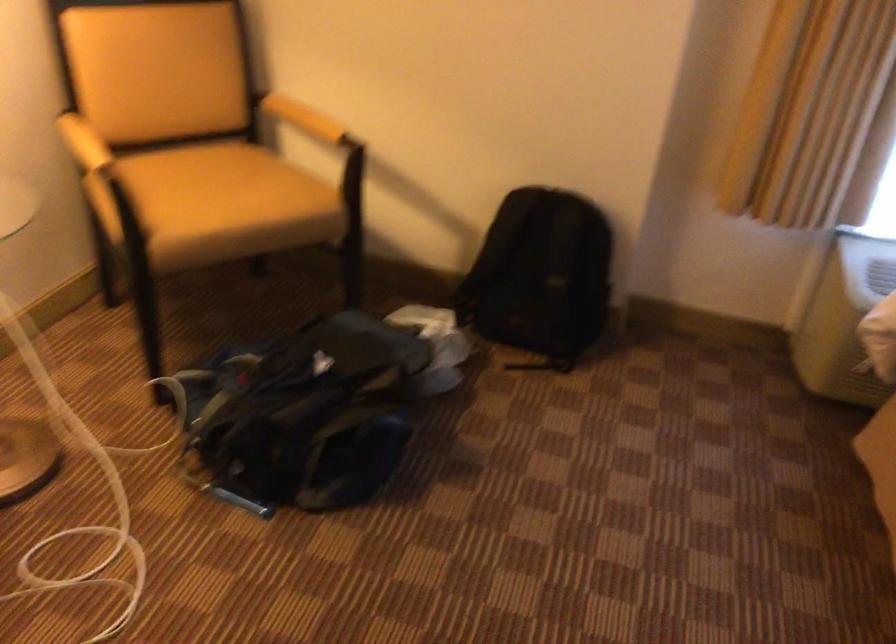
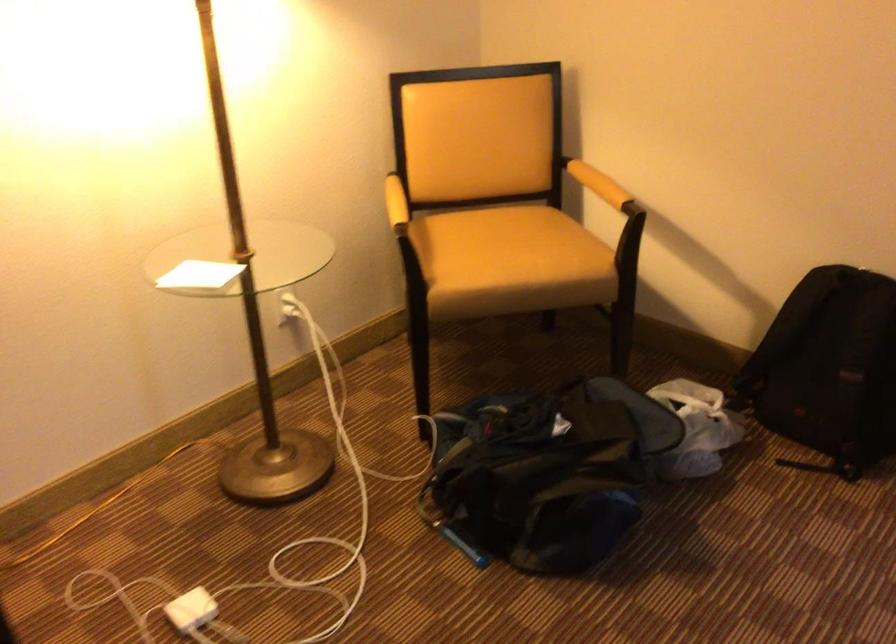
Where in the second image is the point corresponding to the point at 437,350 from the first image?

(696, 428)